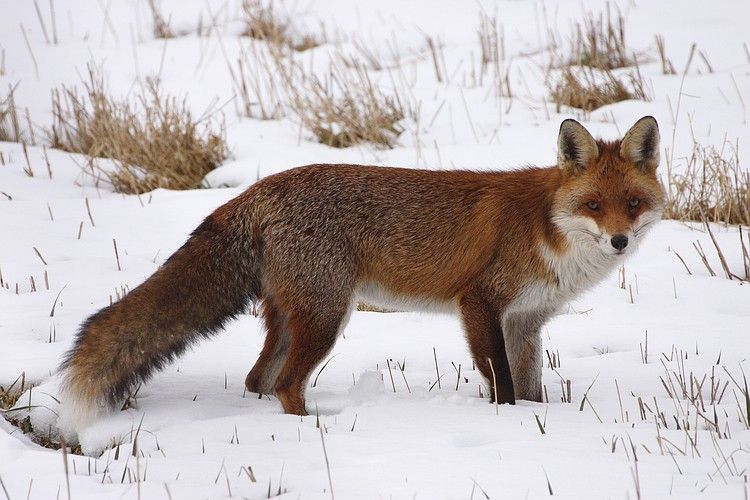
Where is `chest`? The image size is (750, 500). chest is located at coordinates (601, 264).